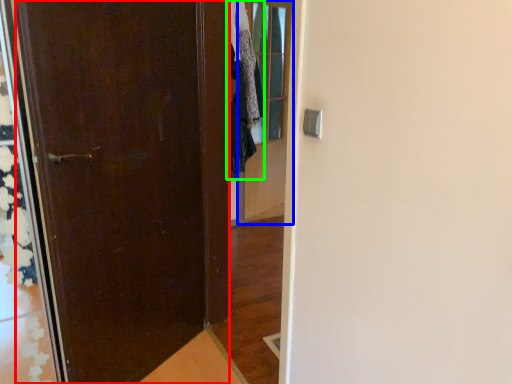
Question: Which object is the farthest from door (highlighted by a red box)? Choose among these: glass door (highlighted by a blue box) or clothing (highlighted by a green box).

Choices:
 (A) glass door
 (B) clothing

Answer: (A)